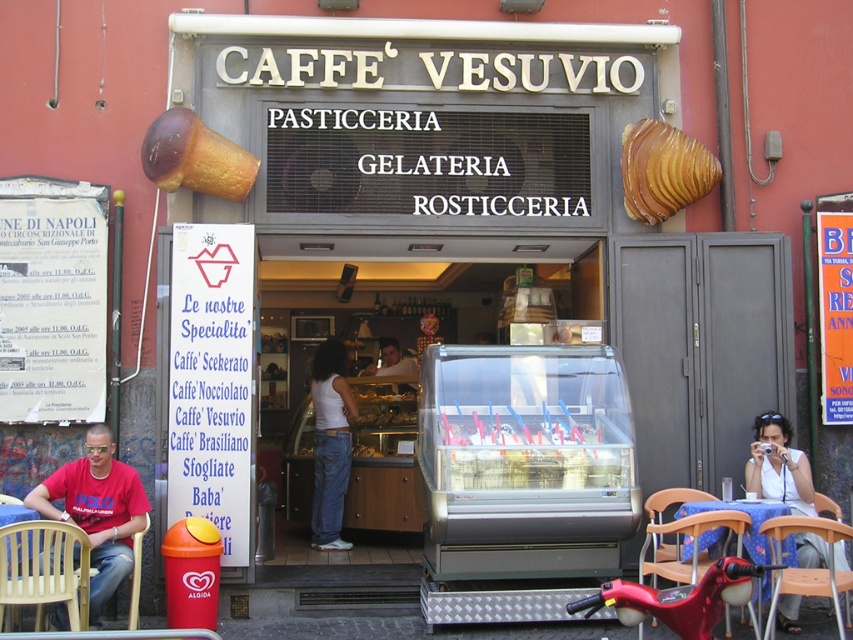
Question: Does white matte shirt at center lie in front of white fabric shirt at lower right?

Choices:
 (A) yes
 (B) no

Answer: (B)

Question: Which of the following is the farthest from the observer?

Choices:
 (A) (633, 125)
 (B) (183, 177)

Answer: (A)

Question: Based on their relative distances, which object is farther from the smooth skin face at center?

Choices:
 (A) brown textured ice cream cone at upper left
 (B) wooden chair at lower right
 (C) golden-brown crispy pastry at upper right
 (D) white matte shirt at center

Answer: (B)

Question: Does plastic yellow chair at lower left appear on the right side of white matte shirt at center?

Choices:
 (A) no
 (B) yes

Answer: (A)

Question: Does white matte shirt at center have a greater width compared to smooth skin face at center?

Choices:
 (A) no
 (B) yes

Answer: (B)

Question: Which object is farther from the camera taking this photo?

Choices:
 (A) plastic chair at lower left
 (B) matte red t-shirt at lower left
 (C) golden-brown crispy pastry at upper right

Answer: (C)